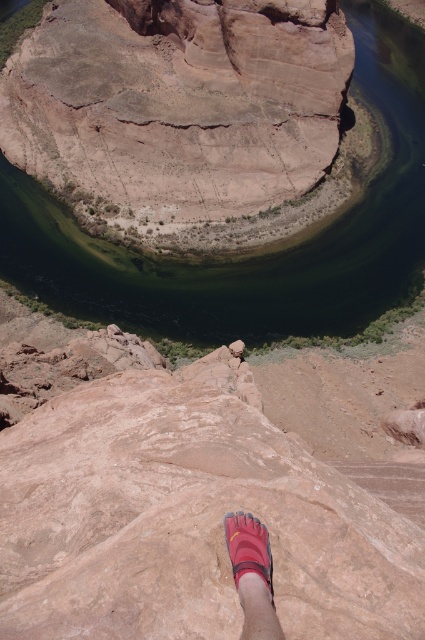
Is dark green water at center to the right of pink fabric foot at lower center from the viewer's perspective?

Correct, you'll find dark green water at center to the right of pink fabric foot at lower center.

Who is higher up, dark green water at center or pink fabric foot at lower center?

dark green water at center

Who is more forward, (33, 250) or (244, 548)?

Point (244, 548)

Where is `dark green water at center`? This screenshot has width=425, height=640. dark green water at center is located at coordinates (261, 253).